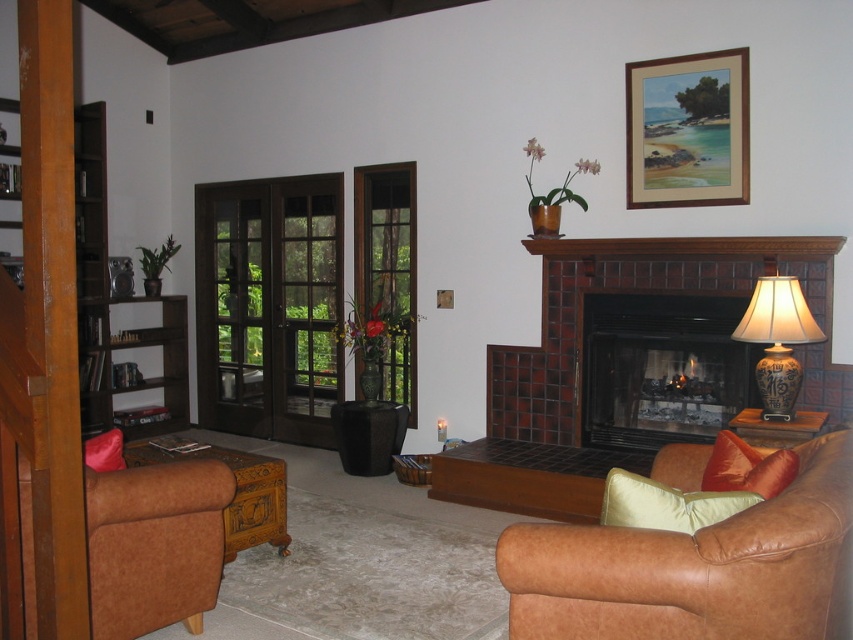
Looking at this image, does brown ceramic lamp at right have a greater width compared to light beige fabric pillow at lower right?

In fact, brown ceramic lamp at right might be narrower than light beige fabric pillow at lower right.

Looking at this image, does brown ceramic lamp at right have a lesser width compared to light beige fabric pillow at lower right?

Indeed, brown ceramic lamp at right has a lesser width compared to light beige fabric pillow at lower right.

I want to click on brown ceramic lamp at right, so click(776, 340).

Can you confirm if brown leather ottoman at lower left is positioned to the left of satin orange pillow at lower right?

Yes, brown leather ottoman at lower left is to the left of satin orange pillow at lower right.

Is brown leather ottoman at lower left bigger than satin orange pillow at lower right?

Yes, brown leather ottoman at lower left is bigger than satin orange pillow at lower right.

What do you see at coordinates (236, 493) in the screenshot? I see `brown leather ottoman at lower left` at bounding box center [236, 493].

I want to click on brown leather ottoman at lower left, so click(236, 493).

Between point (747, 493) and point (778, 490), which one is positioned in front?

Point (747, 493) is in front.

Between light beige fabric pillow at lower right and satin orange pillow at lower right, which one is positioned lower?

light beige fabric pillow at lower right is lower down.

This screenshot has width=853, height=640. In order to click on light beige fabric pillow at lower right in this screenshot , I will do `click(666, 502)`.